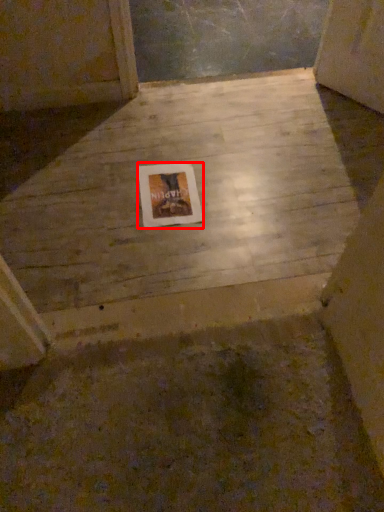
Question: From the image's perspective, where is picture frame (annotated by the red box) located relative to concrete?

Choices:
 (A) above
 (B) below

Answer: (B)